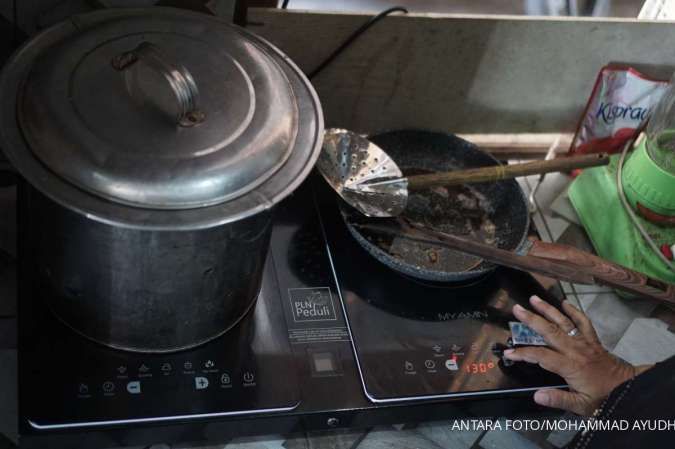
You are a GUI agent. You are given a task and a screenshot of the screen. Output one action in this format:
    pyautogui.click(x=<x>, y=<y>)
    Task: Click on the cooking surface
    The image size is (675, 449).
    Given the screenshot: What is the action you would take?
    pyautogui.click(x=269, y=333), pyautogui.click(x=397, y=307)